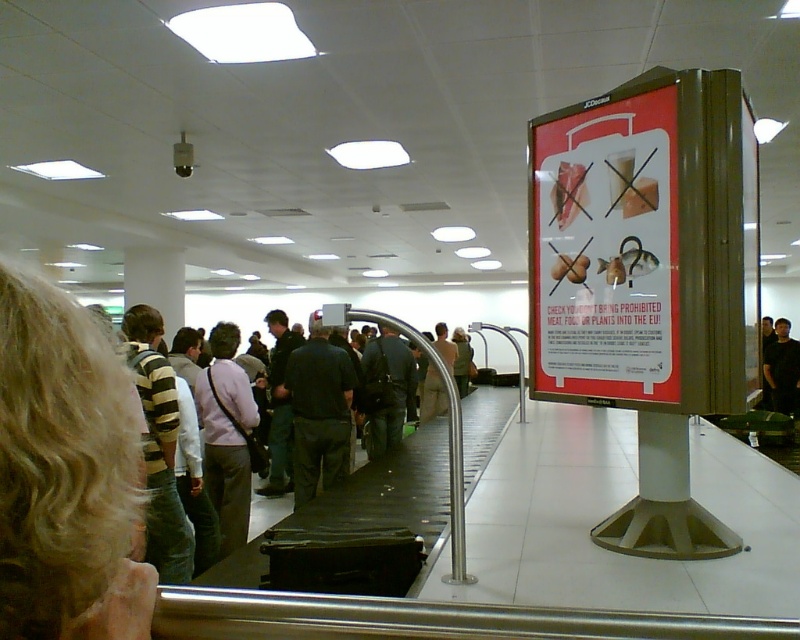
In the scene shown: Can you confirm if blonde hair at upper left is positioned below light brown fabric jacket at center?

No, blonde hair at upper left is not below light brown fabric jacket at center.

Measure the distance between blonde hair at upper left and camera.

They are 13.50 inches apart.

Where is `blonde hair at upper left`? Image resolution: width=800 pixels, height=640 pixels. blonde hair at upper left is located at coordinates (66, 474).

Is matte plastic sign at upper right bigger than dark gray pants at center?

No, matte plastic sign at upper right is not bigger than dark gray pants at center.

Can you confirm if matte plastic sign at upper right is thinner than dark gray pants at center?

Yes.

Is point (558, 323) positioned before point (314, 456)?

Yes.

The width and height of the screenshot is (800, 640). Identify the location of matte plastic sign at upper right. (605, 248).

Who is more distant from viewer, (628,346) or (244,392)?

Point (244,392)

Is point (566, 248) farther from viewer compared to point (232, 518)?

No, (566, 248) is in front of (232, 518).

This screenshot has height=640, width=800. In order to click on matte plastic sign at upper right in this screenshot , I will do pos(605,248).